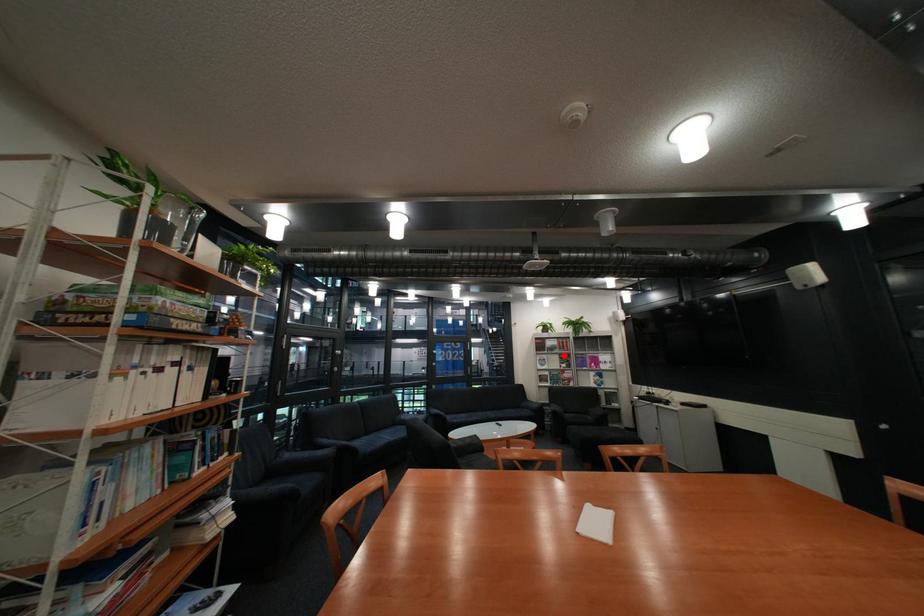
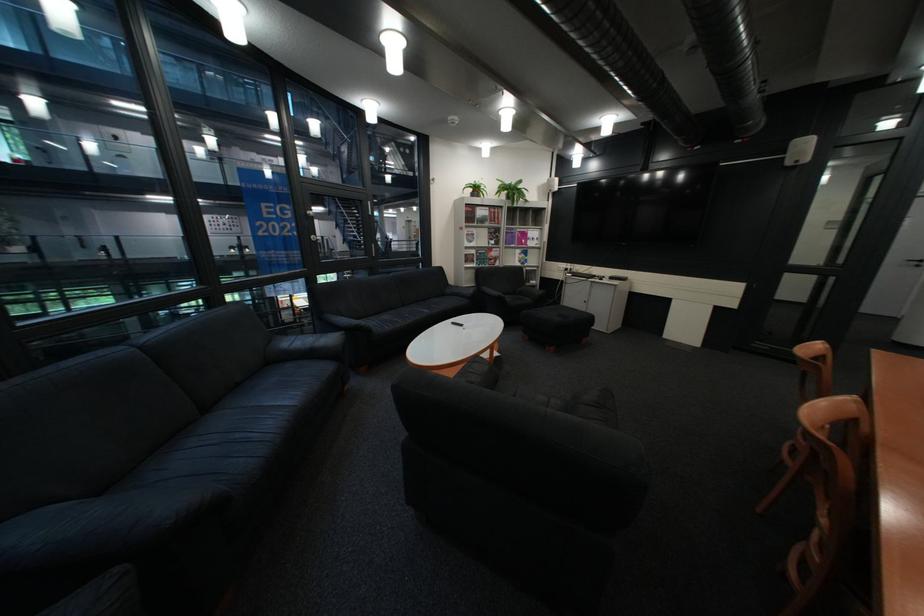
Question: I am providing you with two images of the same scene from different viewpoints. Image1 has a red point marked. In image2, the corresponding 3D location appears at what relative position? Reply with the corresponding letter.

Choices:
 (A) Closer
 (B) Farther

Answer: (A)